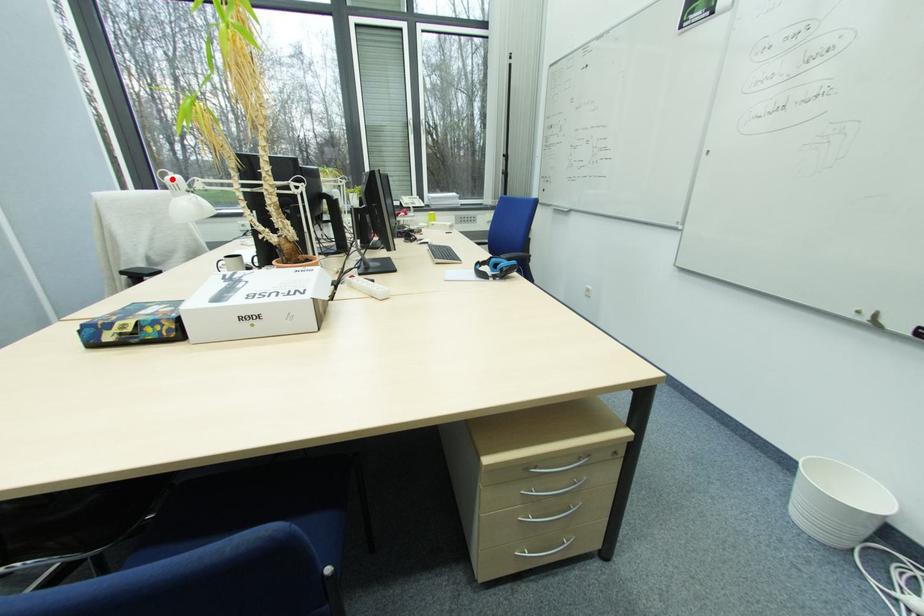
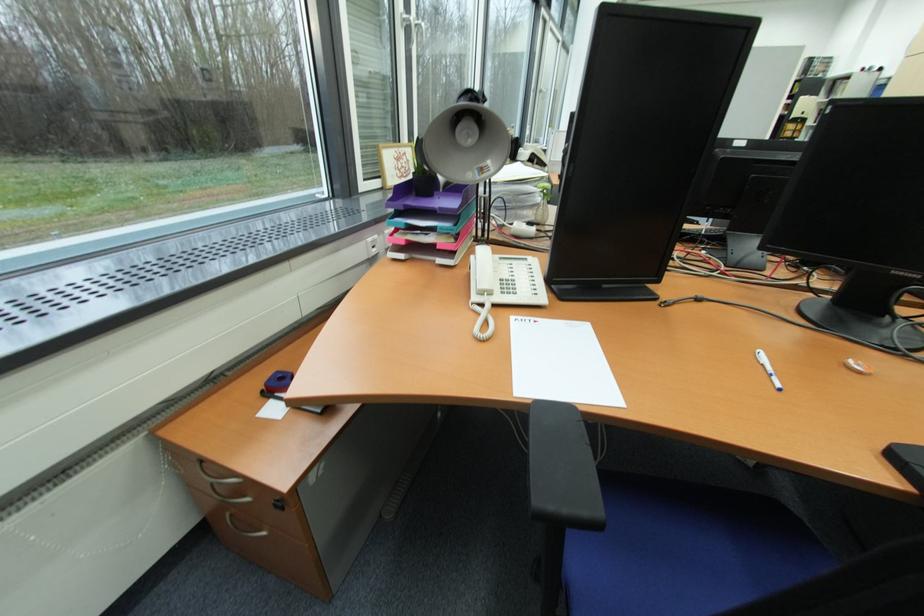
Question: I am providing you with two images of the same scene from different viewpoints. A red point is marked on the first image. At the location where the point appears in image 1, is it still visible in image 2?

Choices:
 (A) Yes
 (B) No

Answer: (B)